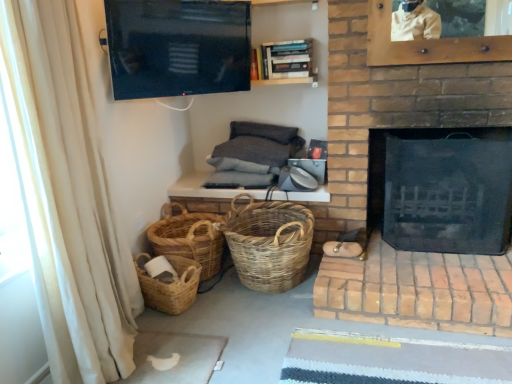
I want to click on free space to the right of woven natural basket at lower left, the first basket positioned from the left, so click(210, 295).